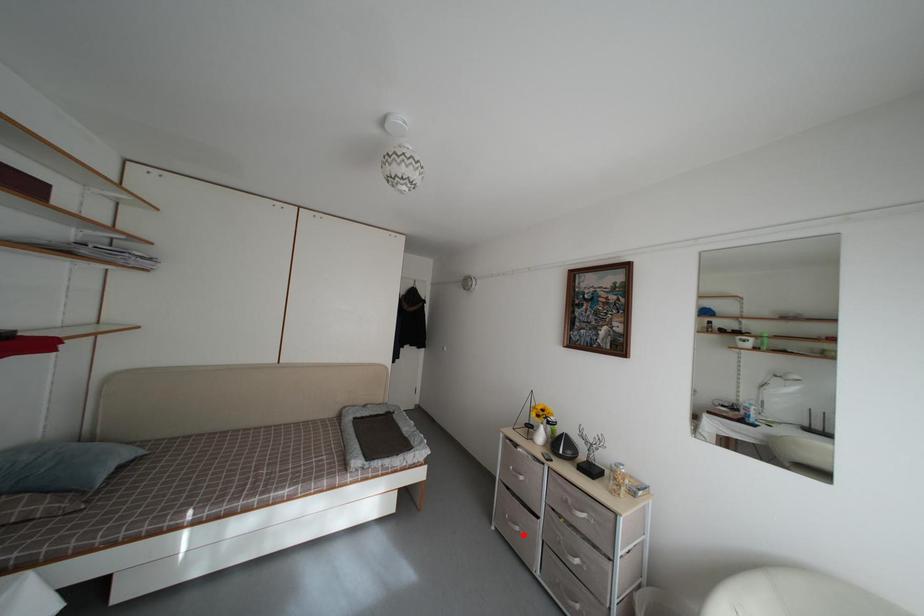
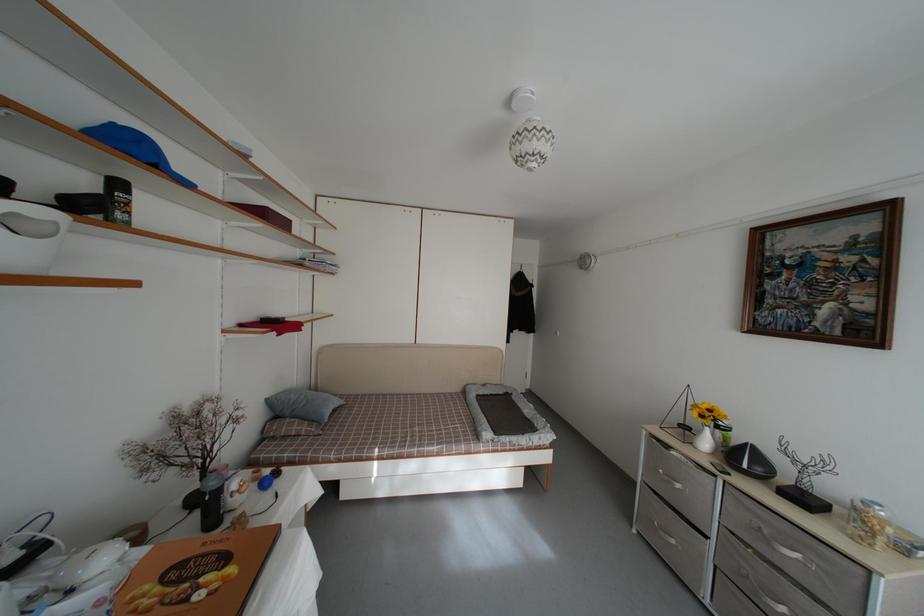
Question: I am providing you with two images of the same scene from different viewpoints. In image1, a red point is highlighted. Considering the same 3D point in image2, which of the following is correct?

Choices:
 (A) It is closer
 (B) It is farther

Answer: (A)